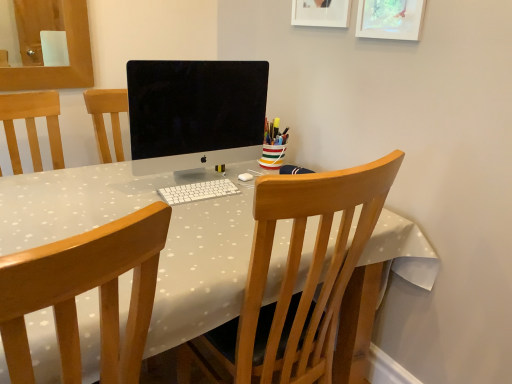
Question: Is wooden chair at center, the 2th chair positioned from the left, to the left or to the right of striped ceramic cup at center in the image?

Choices:
 (A) left
 (B) right

Answer: (A)

Question: Is point (290, 259) positioned closer to the camera than point (265, 130)?

Choices:
 (A) farther
 (B) closer

Answer: (B)

Question: Which is nearer to the white matte picture frame at upper center, arranged as the 1th picture frame when viewed from the left?

Choices:
 (A) sleek silver monitor at center
 (B) wooden chair at center, the second chair when ordered from right to left
 (C) white plastic keyboard at center
 (D) wooden chair at center, the 2th chair positioned from the left
 (E) matte white picture frame at upper right, which is counted as the 1th picture frame, starting from the right

Answer: (E)

Question: Which object is the closest to the matte white picture frame at upper right, which is counted as the 1th picture frame, starting from the right?

Choices:
 (A) white matte picture frame at upper center, arranged as the 1th picture frame when viewed from the left
 (B) striped ceramic cup at center
 (C) wooden chair at center, the first chair viewed from the right
 (D) wooden chair at center, positioned as the 1th chair in left-to-right order
 (E) white plastic keyboard at center

Answer: (A)